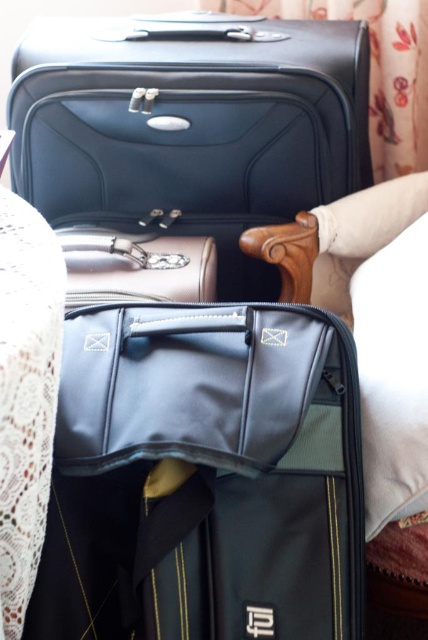
You are packing for a trip and have both the matte black bag at center and the black fabric bed at center in front of you. Which item should you choose if you need a smaller luggage size for your carry on?

The matte black bag at center has a smaller size compared to the black fabric bed at center, so you should choose the matte black bag at center for your carry on.

You are packing for a trip and need to place a new item between the matte black suitcase at upper center and the smaller black bag behind it. Based on their positions, which object is closer to you?

The matte black suitcase at upper center is closer to you because it is located at point (190,129), which is closer in the coordinate system compared to the smaller black bag behind it.

You are packing for a trip and have two luggage items in front of you. You need to choose the larger one to pack your heavier items. Which one should you choose between the matte black suitcase at upper center and the matte black bag at center?

The matte black suitcase at upper center is bigger than the matte black bag at center, so you should choose the matte black suitcase at upper center to pack your heavier items.